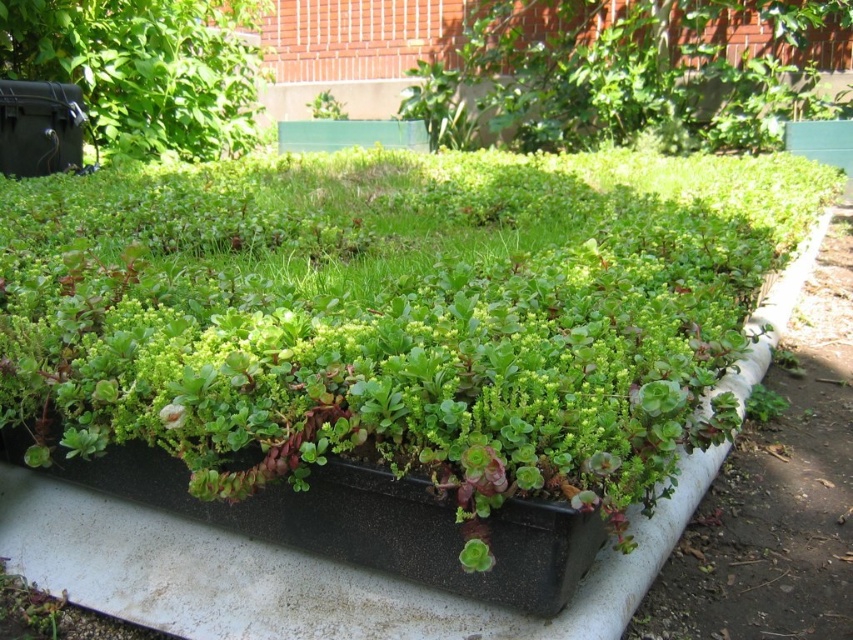
Does green leafy plant at upper center have a smaller size compared to green succulent at center?

No, green leafy plant at upper center is not smaller than green succulent at center.

Which is above, green leafy plant at upper center or green succulent at center?

green succulent at center

Identify the location of green leafy plant at upper center. (614, 70).

Can you confirm if black plastic container at upper left is smaller than green succulent at center?

No.

Is black plastic container at upper left thinner than green succulent at center?

In fact, black plastic container at upper left might be wider than green succulent at center.

Is point (138, 20) positioned after point (320, 113)?

No, it is not.

Image resolution: width=853 pixels, height=640 pixels. In order to click on black plastic container at upper left in this screenshot , I will do `click(144, 68)`.

Does green leafy plant at upper center have a smaller size compared to black plastic container at upper left?

Incorrect, green leafy plant at upper center is not smaller in size than black plastic container at upper left.

Does green leafy plant at upper center have a lesser height compared to black plastic container at upper left?

No.

Is point (508, 52) less distant than point (260, 6)?

No, (508, 52) is further to viewer.

Where is `green leafy plant at upper center`? green leafy plant at upper center is located at coordinates (614, 70).